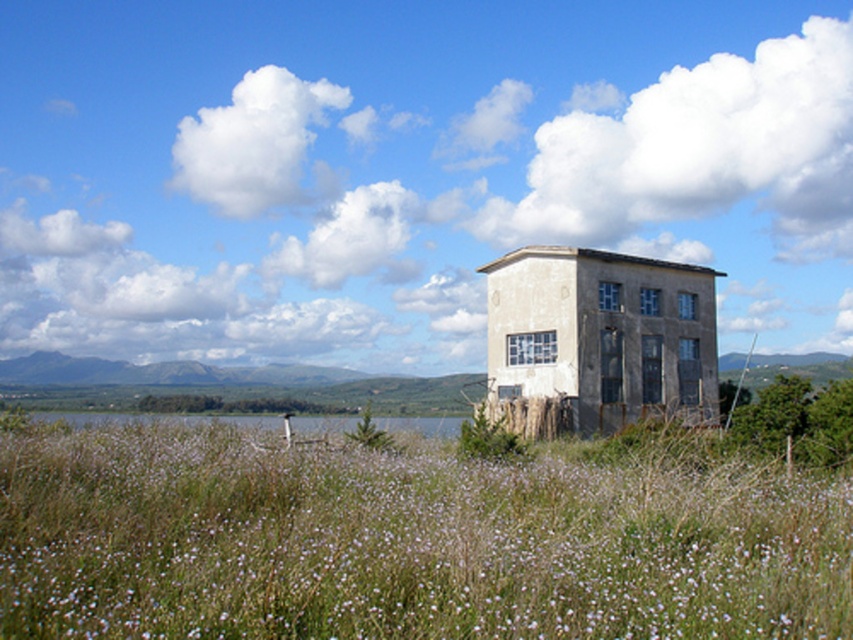
You are standing in the field of wildflowers in front of the weathered building. If you walk straight ahead, will you reach the point at coordinates point (482, 524) before or after passing the building?

The point at coordinates point (482, 524) is 7.49 meters away from the viewer, so if you walk straight ahead, you will reach it before passing the building since the distance is measured from your current position.

You are standing in the field of wildflowers and see two patches of green grass at center and green grass at lower center. Which one is located to the right side of the other?

The green grass at center is located to the right of the green grass at lower center.